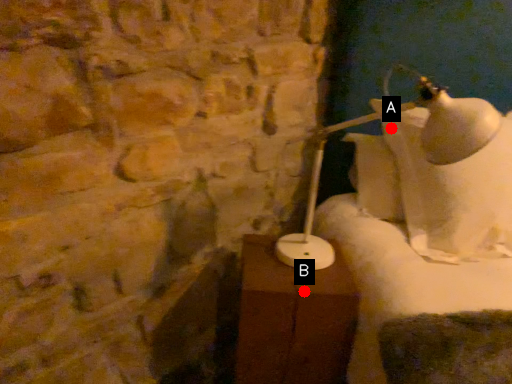
Question: Two points are circled on the image, labeled by A and B beside each circle. Among these points, which one is nearest to the camera?

Choices:
 (A) A is closer
 (B) B is closer

Answer: (B)